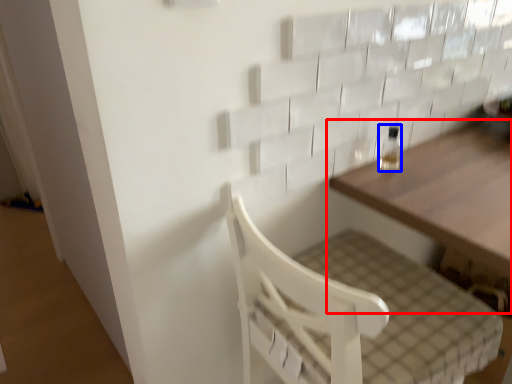
Question: Among these objects, which one is farthest to the camera, table (highlighted by a red box) or bottle (highlighted by a blue box)?

Choices:
 (A) table
 (B) bottle

Answer: (B)